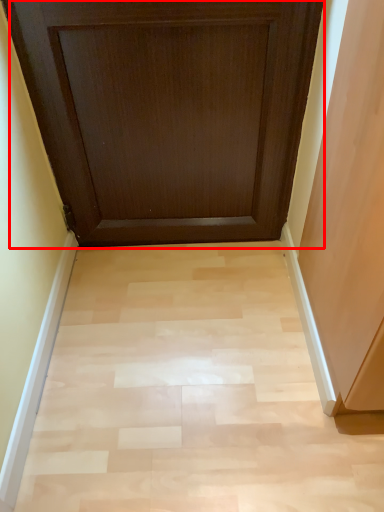
Question: From the image's perspective, where is door (annotated by the red box) located in relation to plain in the image?

Choices:
 (A) below
 (B) above

Answer: (B)